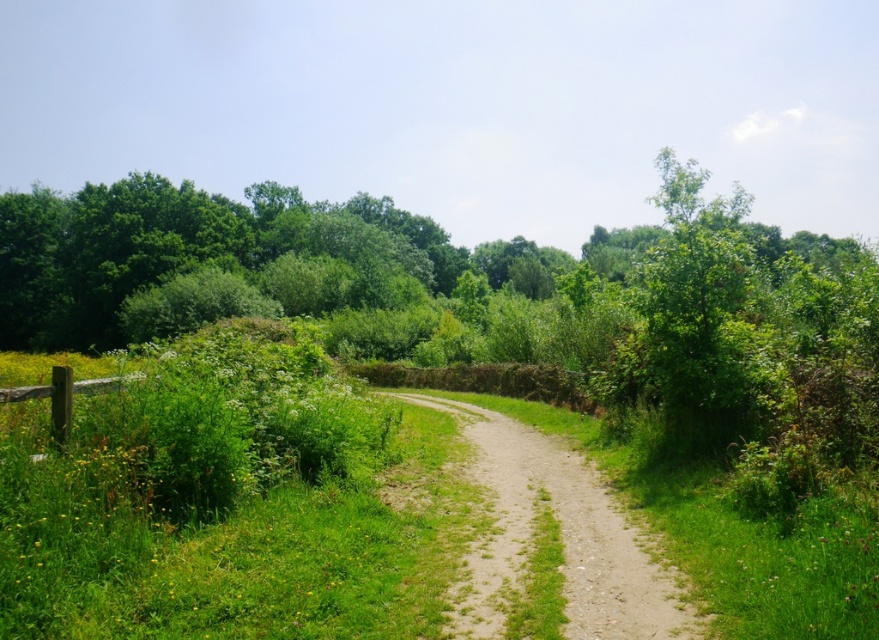
Question: Is green grass at center positioned at the back of brown wooden fence at lower left?

Choices:
 (A) no
 (B) yes

Answer: (A)

Question: Which of the following is the closest to the observer?

Choices:
 (A) green leafy tree at left
 (B) dirt/gravel path at center
 (C) green grass at center
 (D) brown wooden fence at lower left

Answer: (C)

Question: Among these objects, which one is farthest from the camera?

Choices:
 (A) green leafy tree at left
 (B) dirt/gravel path at center
 (C) brown wooden fence at lower left
 (D) green grass at center

Answer: (A)

Question: Can you confirm if dirt/gravel path at center is positioned above brown wooden fence at lower left?

Choices:
 (A) yes
 (B) no

Answer: (B)

Question: Is green leafy tree at left above green grass at center?

Choices:
 (A) yes
 (B) no

Answer: (A)

Question: Considering the real-world distances, which object is closest to the green leafy tree at left?

Choices:
 (A) brown wooden fence at lower left
 (B) dirt/gravel path at center

Answer: (B)